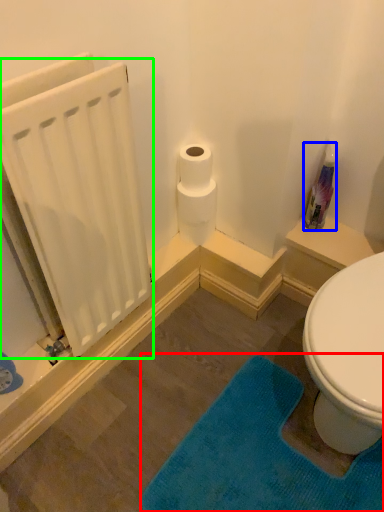
Question: Considering the real-world distances, which object is farthest from bath mat (highlighted by a red box)? cleaning product (highlighted by a blue box) or radiator (highlighted by a green box)?

Choices:
 (A) cleaning product
 (B) radiator

Answer: (A)